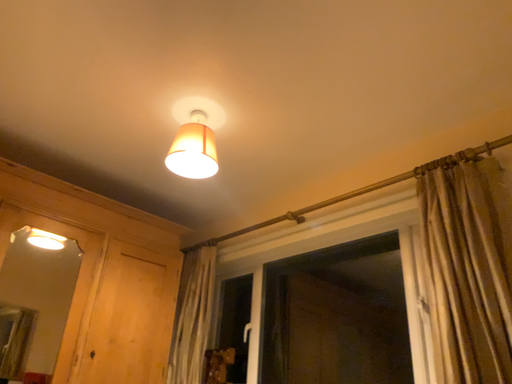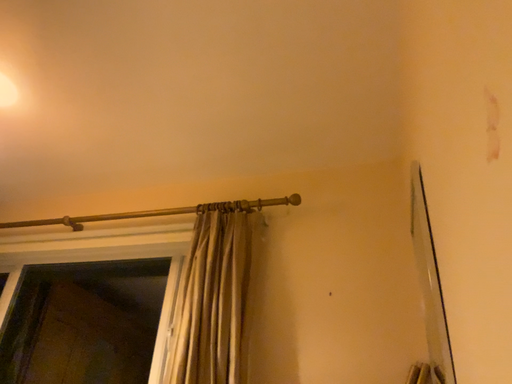
Question: How did the camera likely rotate when shooting the video?

Choices:
 (A) rotated right
 (B) rotated left

Answer: (A)